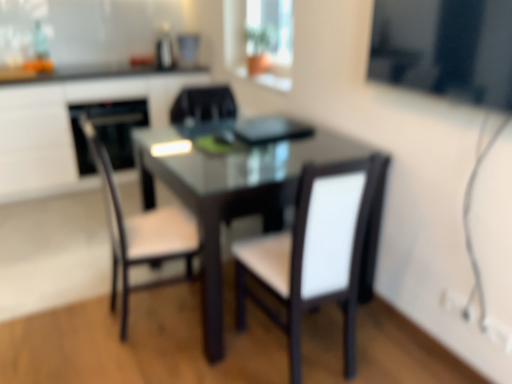
Question: Is white leather chair at center, the third chair positioned from the left, thinner than matte black desk at center?

Choices:
 (A) no
 (B) yes

Answer: (B)

Question: Is white leather chair at center, the first chair from the right, completely or partially outside of matte black desk at center?

Choices:
 (A) yes
 (B) no

Answer: (A)

Question: Is the depth of white leather chair at center, the first chair from the right, greater than that of matte black desk at center?

Choices:
 (A) no
 (B) yes

Answer: (A)

Question: From a real-world perspective, is white leather chair at center, the first chair from the right, on matte black desk at center?

Choices:
 (A) no
 (B) yes

Answer: (B)

Question: Is white leather chair at center, the first chair from the right, facing away from matte black desk at center?

Choices:
 (A) no
 (B) yes

Answer: (A)

Question: Is matte black desk at center in front of or behind black glossy oven at left in the image?

Choices:
 (A) front
 (B) behind

Answer: (A)

Question: Considering the positions of point (62, 144) and point (120, 122), is point (62, 144) closer or farther from the camera than point (120, 122)?

Choices:
 (A) farther
 (B) closer

Answer: (B)

Question: From a real-world perspective, is matte black desk at center positioned above or below black glossy oven at left?

Choices:
 (A) below
 (B) above

Answer: (B)

Question: Is matte black desk at center to the left or to the right of black glossy oven at left in the image?

Choices:
 (A) right
 (B) left

Answer: (B)

Question: In terms of height, does white matte chair at center, which is the 1th chair in left-to-right order, look taller or shorter compared to matte glass window at upper center, arranged as the 1th window screen when viewed from the top?

Choices:
 (A) short
 (B) tall

Answer: (B)

Question: Relative to matte glass window at upper center, which is counted as the 1th window screen, starting from the back, is white matte chair at center, which is counted as the third chair, starting from the right, in front or behind?

Choices:
 (A) front
 (B) behind

Answer: (A)

Question: Considering the positions of point (163, 249) and point (245, 46), is point (163, 249) closer or farther from the camera than point (245, 46)?

Choices:
 (A) farther
 (B) closer

Answer: (B)

Question: From a real-world perspective, is white matte chair at center, which is counted as the third chair, starting from the right, physically located above or below matte glass window at upper center, arranged as the 1th window screen when viewed from the top?

Choices:
 (A) above
 (B) below

Answer: (B)

Question: From a real-world perspective, is black glossy oven at left physically located above or below transparent glass window screen at upper right, which appears as the 1th window screen when ordered from the bottom?

Choices:
 (A) below
 (B) above

Answer: (A)

Question: Would you say black glossy oven at left is inside or outside transparent glass window screen at upper right, marked as the first window screen in a front-to-back arrangement?

Choices:
 (A) outside
 (B) inside

Answer: (A)